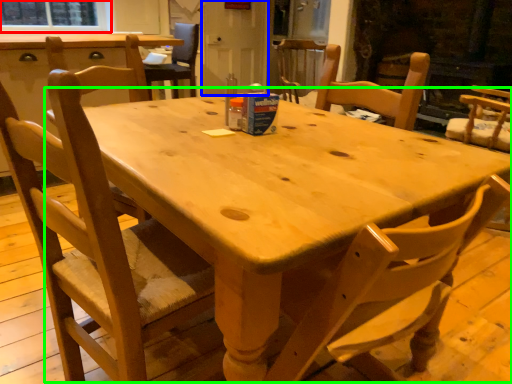
Question: Which is farther away from window screen (highlighted by a red box)? screen door (highlighted by a blue box) or round table (highlighted by a green box)?

Choices:
 (A) screen door
 (B) round table

Answer: (B)